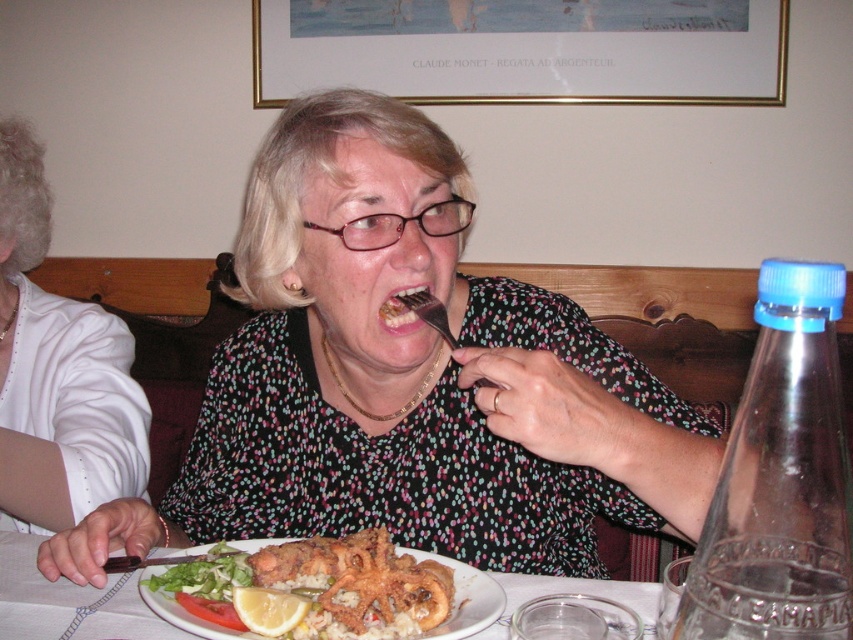
You are a waiter who needs to place a new drink order for the woman seated at the table. The drink must be placed on the table without obstructing the white ceramic plate at center or the yellow matte lemon at plate center. Where should you place the drink to ensure it is visible but not blocking either item?

The white ceramic plate at center is further to the viewer than the yellow matte lemon at plate center, so placing the drink behind the white ceramic plate at center would keep it visible while avoiding obstruction of both items.

You are a fashion designer observing the woman in the restaurant. You need to determine which item, the matte black dress at center or the yellow matte lemon at plate center, would require more fabric to create. Based on the image, which one would you choose?

The matte black dress at center is larger in size than the yellow matte lemon at plate center, so it would require more fabric to create.

You are a waiter in a restaurant and need to place a new dish on the table. The dish must be placed behind the matte black dress at center but in front of the yellow matte lemon at plate center. Is this possible?

The matte black dress at center is in front of the yellow matte lemon at plate center, so placing the dish behind the matte black dress at center would also place it behind the yellow matte lemon at plate center. Therefore, it is not possible to place the dish behind the matte black dress at center but in front of the yellow matte lemon at plate center.